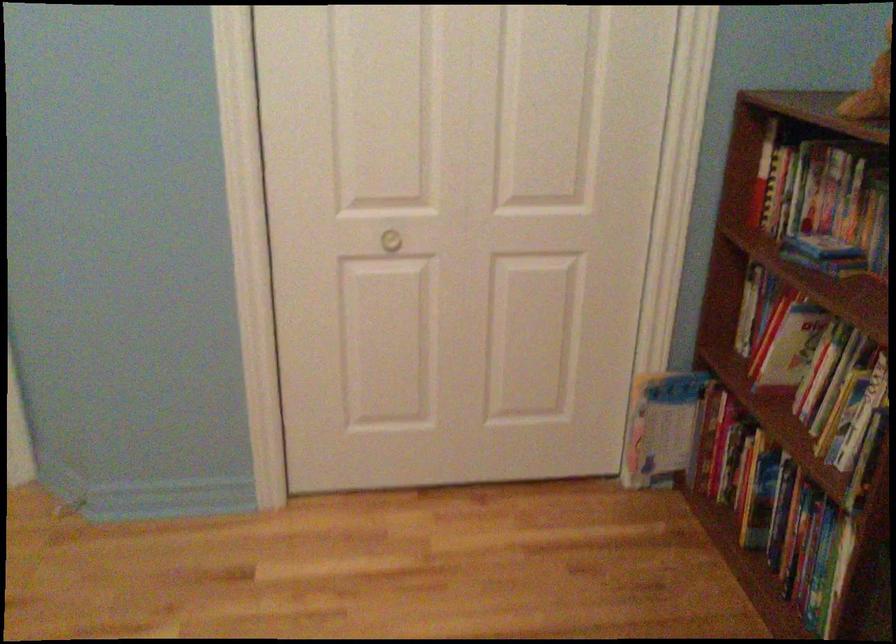
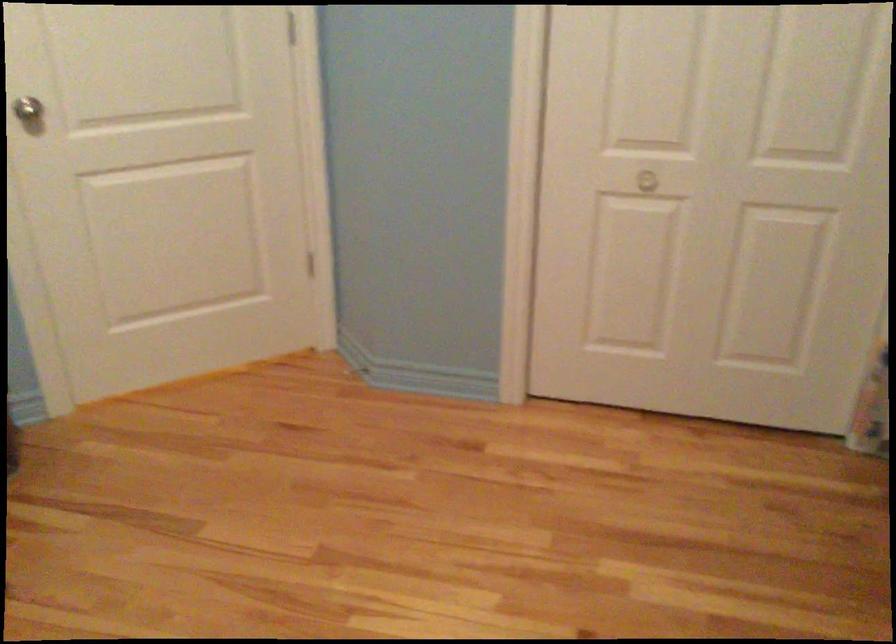
The point at (x=403, y=239) is marked in the first image. Where is the corresponding point in the second image?

(658, 176)